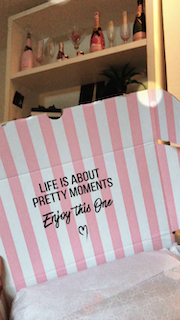
Image resolution: width=180 pixels, height=320 pixels. Identify the location of 1 martini glass. (75, 33).